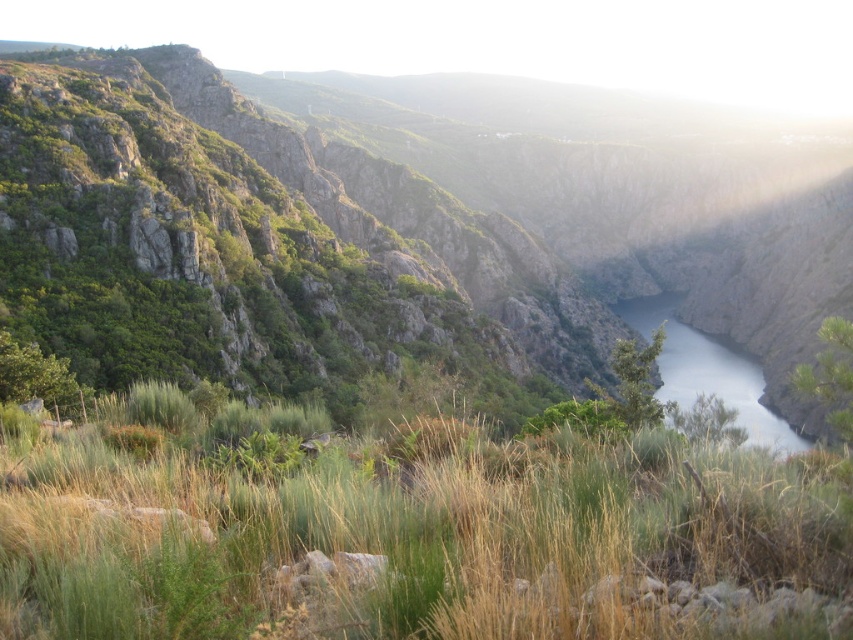
Question: Is green rock at center thinner than green grassy at center?

Choices:
 (A) no
 (B) yes

Answer: (A)

Question: Which of the following is the farthest from the observer?

Choices:
 (A) green rock at center
 (B) clear water at center
 (C) green grassy at center

Answer: (A)

Question: Is green rock at center further to camera compared to green grassy at center?

Choices:
 (A) no
 (B) yes

Answer: (B)

Question: Among these points, which one is nearest to the camera?

Choices:
 (A) (x=15, y=467)
 (B) (x=743, y=340)
 (C) (x=751, y=438)

Answer: (A)

Question: Can you confirm if green rock at center is positioned below green grassy at center?

Choices:
 (A) yes
 (B) no

Answer: (B)

Question: Which point is farther to the camera?

Choices:
 (A) (57, 236)
 (B) (715, 346)
 (C) (550, 572)

Answer: (B)